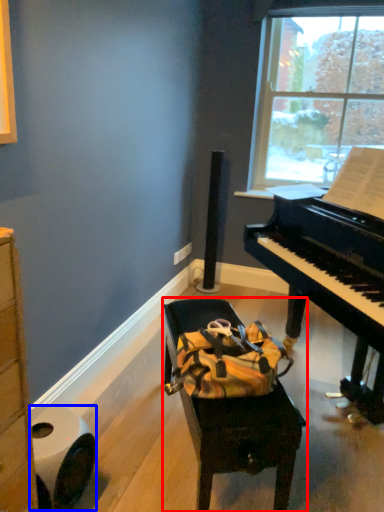
Question: Which object is further to the camera taking this photo, furniture (highlighted by a red box) or toilet paper (highlighted by a blue box)?

Choices:
 (A) furniture
 (B) toilet paper

Answer: (A)